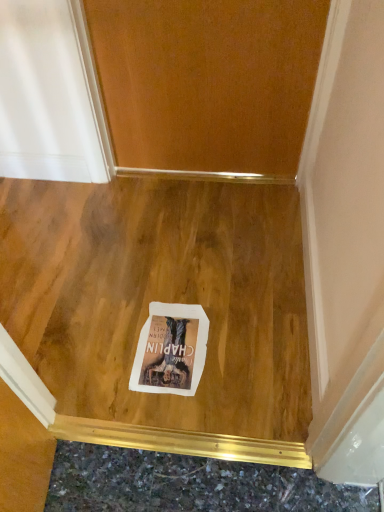
In order to click on free space above white paper postcard at center (from a real-world perspective) in this screenshot , I will do `click(164, 344)`.